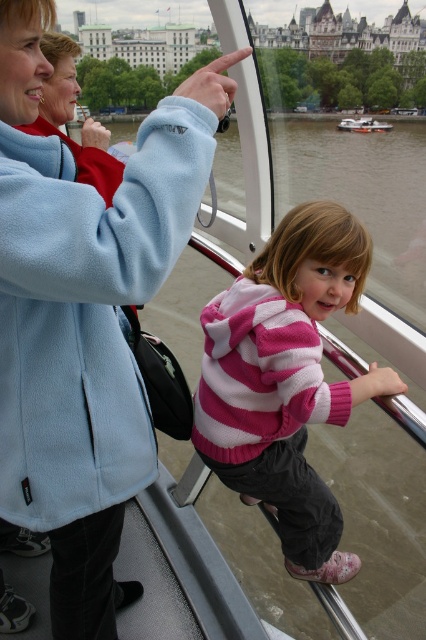
Can you confirm if light blue fleece jacket at upper left is smaller than white plastic boat at center?

No.

Which is more to the right, light blue fleece jacket at upper left or white plastic boat at center?

Positioned to the right is white plastic boat at center.

Is point (94, 548) farther from camera compared to point (368, 122)?

No, it is in front of (368, 122).

What are the coordinates of `light blue fleece jacket at upper left` in the screenshot? It's located at (83, 314).

Is pink striped sweater at center positioned in front of white plastic boat at center?

Yes, it is in front of white plastic boat at center.

The width and height of the screenshot is (426, 640). What do you see at coordinates (285, 380) in the screenshot?
I see `pink striped sweater at center` at bounding box center [285, 380].

Who is more distant from viewer, (265, 262) or (347, 129)?

Point (347, 129)

Where is `pink striped sweater at center`? pink striped sweater at center is located at coordinates (285, 380).

The height and width of the screenshot is (640, 426). What are the coordinates of `light blue fleece jacket at upper left` in the screenshot? It's located at (83, 314).

The height and width of the screenshot is (640, 426). What do you see at coordinates (83, 314) in the screenshot?
I see `light blue fleece jacket at upper left` at bounding box center [83, 314].

Is point (86, 490) in front of point (299, 474)?

Yes, it is.

At what (x,y) coordinates should I click in order to perform the action: click on light blue fleece jacket at upper left. Please return your answer as a coordinate pair (x, y). The image size is (426, 640). Looking at the image, I should click on (83, 314).